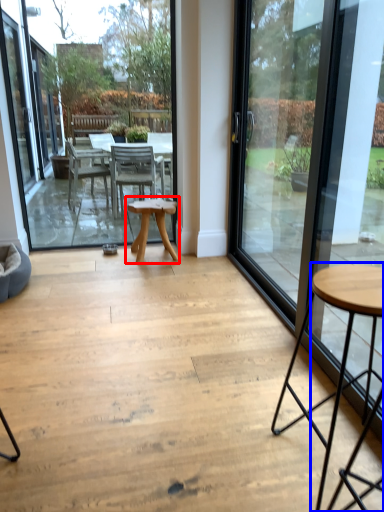
Question: Which of the following is the farthest to the observer, table (highlighted by a red box) or coffee table (highlighted by a blue box)?

Choices:
 (A) table
 (B) coffee table

Answer: (A)